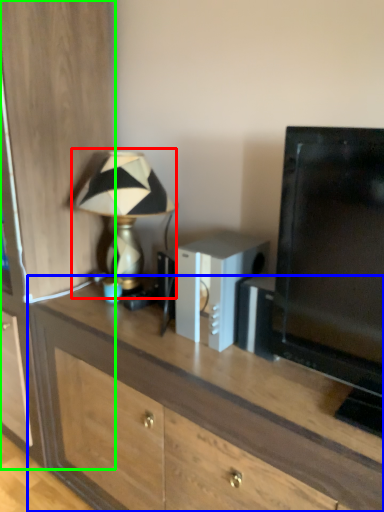
Question: Estimate the real-world distances between objects in this image. Which object is farther from lamp (highlighted by a red box), desk (highlighted by a blue box) or cabinetry (highlighted by a green box)?

Choices:
 (A) desk
 (B) cabinetry

Answer: (A)